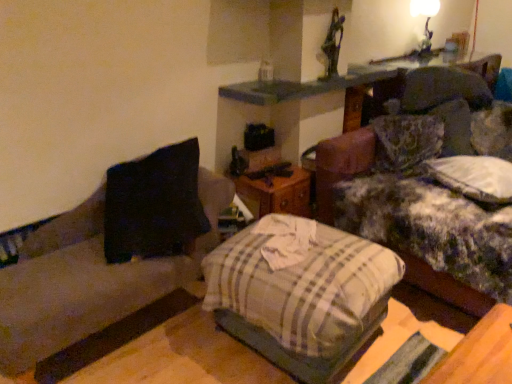
Question: Is white glossy lampshade at upper right wider or thinner than plaid fabric pillow at center?

Choices:
 (A) wide
 (B) thin

Answer: (B)

Question: From a real-world perspective, relative to plaid fabric pillow at center, is white glossy lampshade at upper right vertically above or below?

Choices:
 (A) below
 (B) above

Answer: (B)

Question: Estimate the real-world distances between objects in this image. Which object is farther from the plaid fabric pillow at center?

Choices:
 (A) white glossy lampshade at upper right
 (B) black fabric couch at left
 (C) fluffy fabric couch at upper right

Answer: (A)

Question: Based on their relative distances, which object is farther from the white glossy lampshade at upper right?

Choices:
 (A) fluffy fabric couch at upper right
 (B) black fabric couch at left
 (C) plaid fabric pillow at center

Answer: (B)